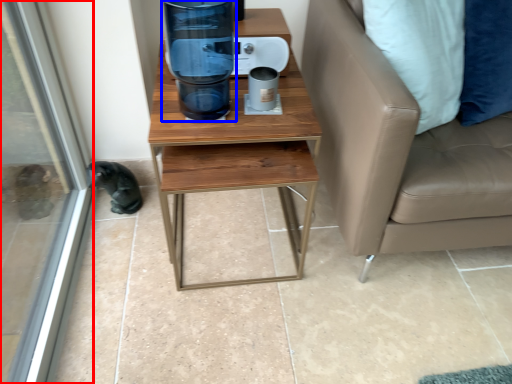
Question: Which point is further to the camera, screen door (highlighted by a red box) or water cooler (highlighted by a blue box)?

Choices:
 (A) screen door
 (B) water cooler

Answer: (B)